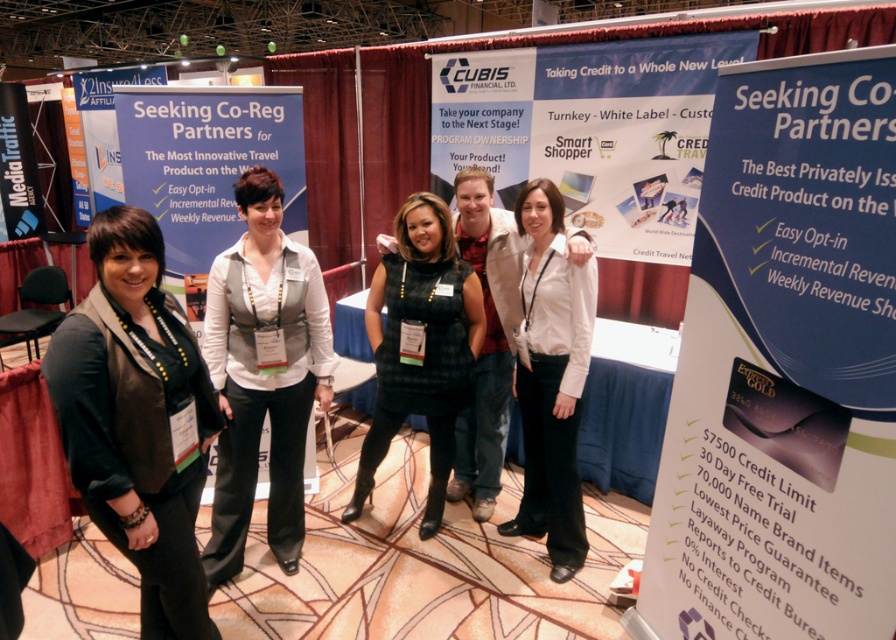
Question: Does matte brown vest at left appear over white textured vest at center?

Choices:
 (A) no
 (B) yes

Answer: (A)

Question: Which point appears farthest from the camera in this image?

Choices:
 (A) (560, 349)
 (B) (233, 493)
 (C) (168, 625)
 (D) (393, 353)

Answer: (D)

Question: Which point is closer to the camera?

Choices:
 (A) white textured vest at center
 (B) matte brown vest at left
 (C) white matte shirt at center
 (D) black plaid dress at center

Answer: (B)

Question: Based on their relative distances, which object is farther from the black plaid dress at center?

Choices:
 (A) matte brown vest at left
 (B) white matte shirt at center
 (C) white textured vest at center

Answer: (A)

Question: Can you confirm if matte brown vest at left is thinner than white matte shirt at center?

Choices:
 (A) no
 (B) yes

Answer: (B)

Question: Does black plaid dress at center have a lesser width compared to white matte shirt at center?

Choices:
 (A) no
 (B) yes

Answer: (A)